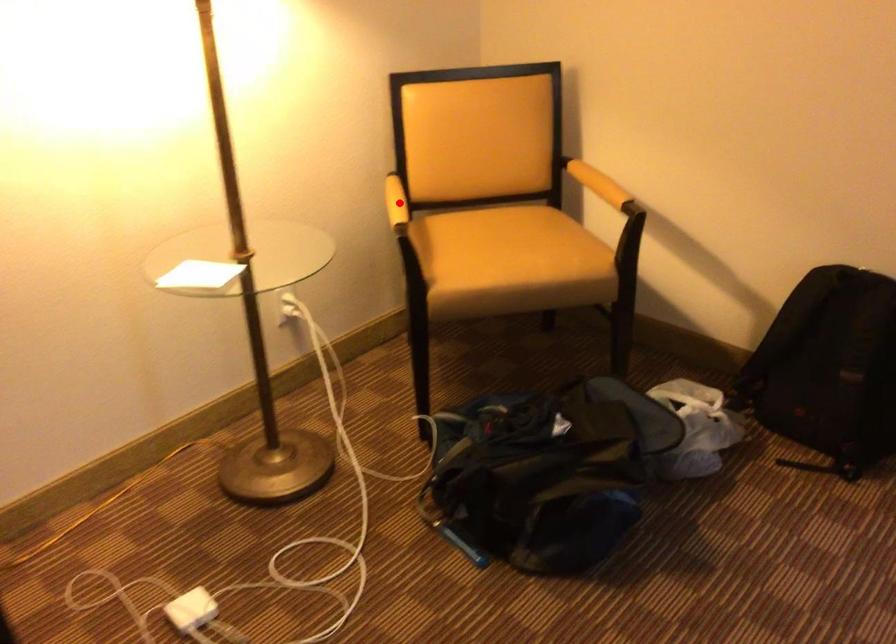
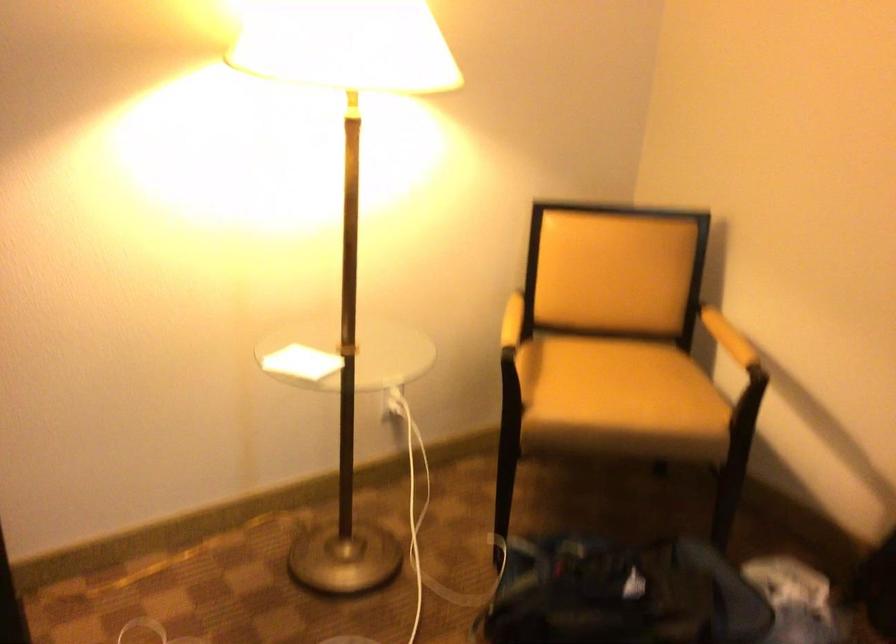
Locate, in the second image, the point that corresponds to the highlighted location in the first image.

(512, 321)